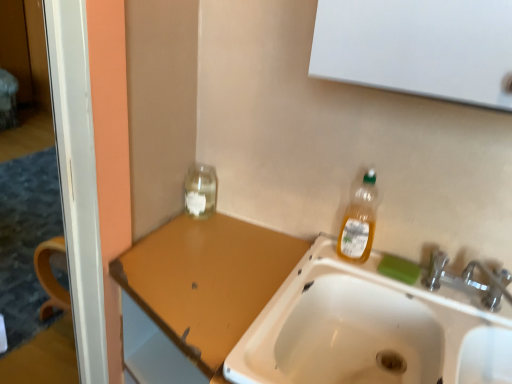
Where is `vacant area to the right of green matte bar of soap at sink right`? vacant area to the right of green matte bar of soap at sink right is located at coordinates (457, 296).